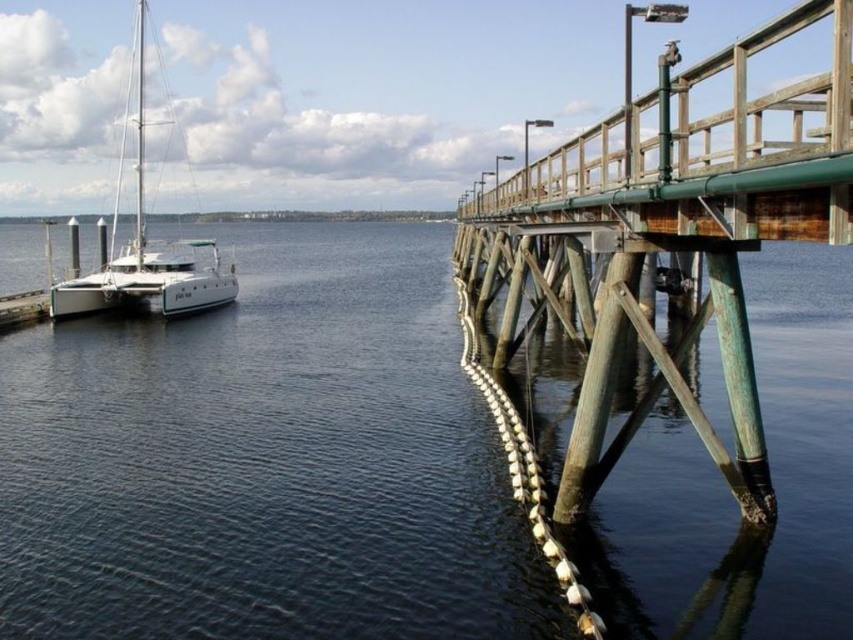
You are standing on the green wooden pier at upper center and want to board the white matte sailboat at left. Which direction should you move to reach the boat?

To board the white matte sailboat at left from the green wooden pier at upper center, you should move upward because the pier is below the sailboat.

You are standing on the wooden pier and want to walk towards the point marked at coordinates point (476, 541). From your current position at point (685, 198), which direction should you move to reach the target point?

Since point (476, 541) is behind point (685, 198), you should move backward to reach the target point.